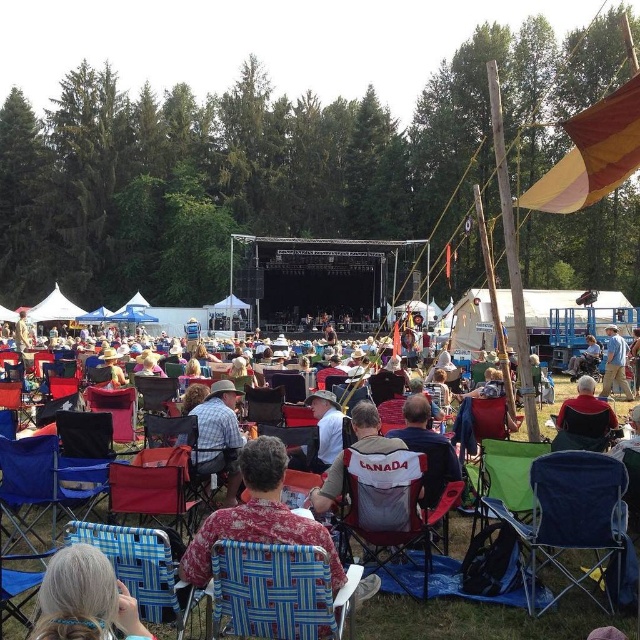
You are an event organizer who needs to ensure there is enough space between the plaid shirt at center and the matte black folding chair at center for attendees to walk comfortably. What is the minimum width required for a walking path between them?

The plaid shirt at center has a lesser width compared to the matte black folding chair at center. To ensure a comfortable walking path, the minimum width should be at least 1 meter, considering the space needed for attendees to pass safely between the two objects.